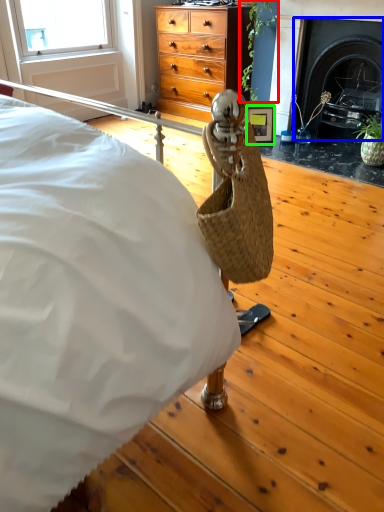
Question: Based on their relative distances, which object is nearer to plant (highlighted by a red box)? Choose from fireplace (highlighted by a blue box) and picture frame (highlighted by a green box).

Choices:
 (A) fireplace
 (B) picture frame

Answer: (B)